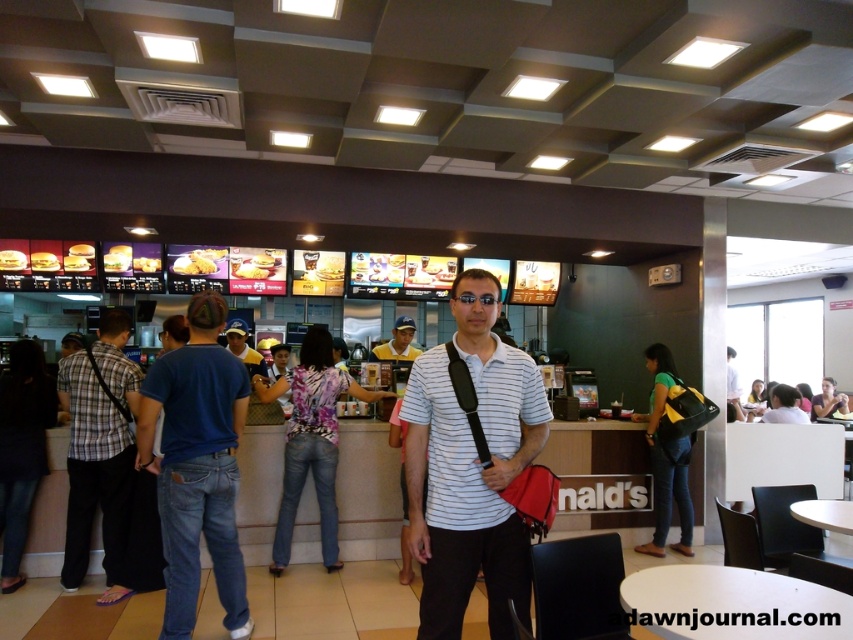
Is white striped shirt at center behind plaid shirt at left?

No, it is not.

Does white striped shirt at center appear on the left side of plaid shirt at left?

In fact, white striped shirt at center is to the right of plaid shirt at left.

At what (x,y) coordinates should I click in order to perform the action: click on white striped shirt at center. Please return your answer as a coordinate pair (x, y). The height and width of the screenshot is (640, 853). Looking at the image, I should click on (471, 467).

Is blue jeans at center further to the viewer compared to golden crispy burger at center?

No, it is not.

Which is above, blue jeans at center or golden crispy burger at center?

golden crispy burger at center

Is point (196, 465) positioned before point (50, 268)?

Yes, it is in front of point (50, 268).

Find the location of `blue jeans at center`. blue jeans at center is located at coordinates (196, 467).

Does light blue fabric shirt at center have a greater width compared to golden crispy burger at center?

Yes.

Locate an element on the screen. This screenshot has height=640, width=853. light blue fabric shirt at center is located at coordinates (397, 342).